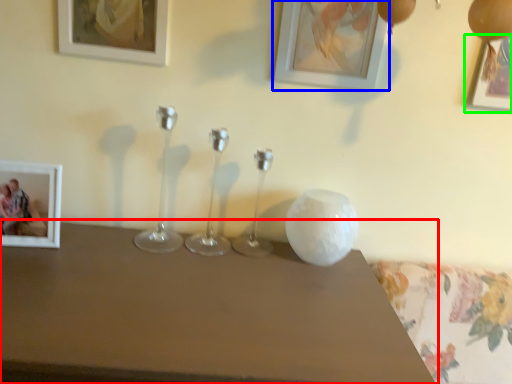
Question: Which object is positioned closest to table (highlighted by a red box)? Select from picture frame (highlighted by a blue box) and picture frame (highlighted by a green box).

Choices:
 (A) picture frame
 (B) picture frame

Answer: (A)